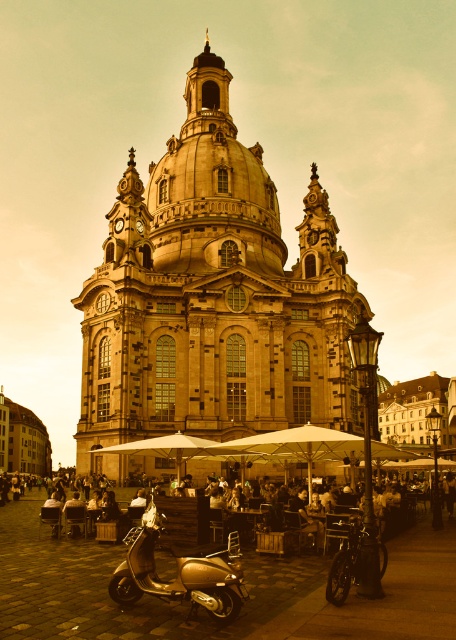
You are standing in the outdoor seating area and want to take a photo of the golden stone church at center without the matte black scooter at lower left blocking the view. Which direction should you move to ensure the scooter is out of frame?

Move towards the golden stone church at center to get closer to it, which will make the matte black scooter at lower left appear smaller in the frame, potentially moving it out of the photo.

You are standing at the entrance of the golden stone church at center. If you walk straight ahead, which direction will you face relative to the outdoor seating area with white umbrellas?

The golden stone church at center is located at point (212,300), so walking straight ahead from the entrance would face you towards the outdoor seating area with white umbrellas in front of the building.

You are standing at the entrance of the grand historic building and want to reach the gold metallic scooter at center. According to the coordinates provided, in which direction should you walk to locate it?

The gold metallic scooter at center is located at coordinates point (x=179, y=572). Since the x coordinate 0.894 is closer to 1, it means the scooter is positioned to the right side of the image. The y coordinate 0.393 is closer to 0.5, so it is near the middle vertically. Therefore, you should walk towards the right side of the building to find the gold metallic scooter at center.